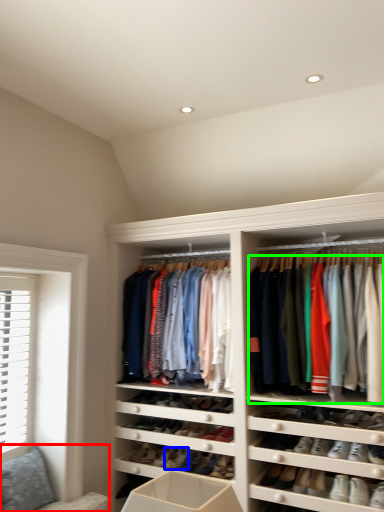
Question: Based on their relative distances, which object is farther from couch (highlighted by a red box)? Choose from shoe (highlighted by a blue box) and clothing (highlighted by a green box).

Choices:
 (A) shoe
 (B) clothing

Answer: (B)